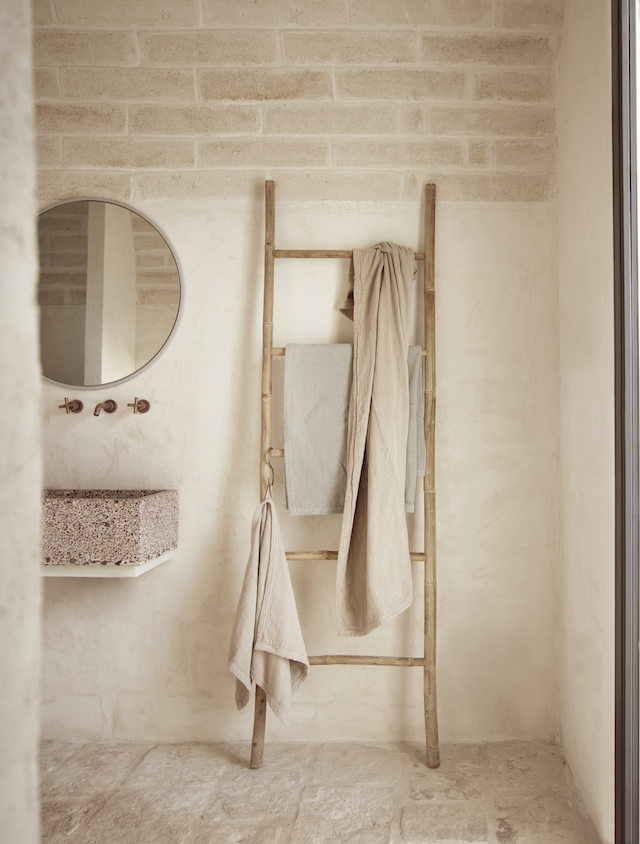
Find the location of `sink`. sink is located at coordinates (109, 522).